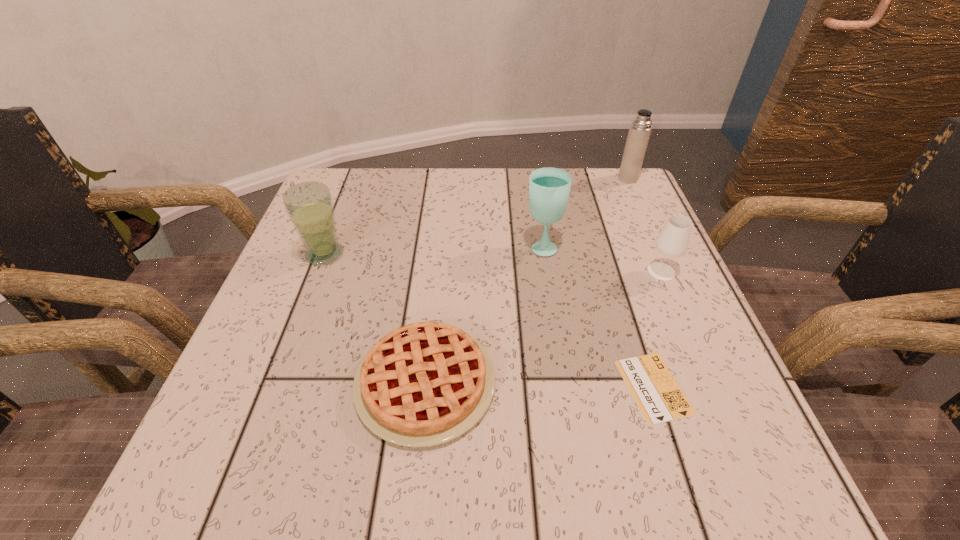
Identify which glass is located as the second nearest to the second glass from right to left. Please provide its 2D coordinates. Your answer should be formatted as a tuple, i.e. [(x, y)], where the tuple contains the x and y coordinates of a point satisfying the conditions above.

[(309, 205)]

Find the location of a particular element. vacant space that satisfies the following two spatial constraints: 1. on the back side of the leftmost glass; 2. on the right side of the thermos bottle is located at coordinates (354, 178).

This screenshot has height=540, width=960. Identify the location of free location that satisfies the following two spatial constraints: 1. on the back side of the thermos bottle; 2. on the left side of the leftmost glass. (354, 178).